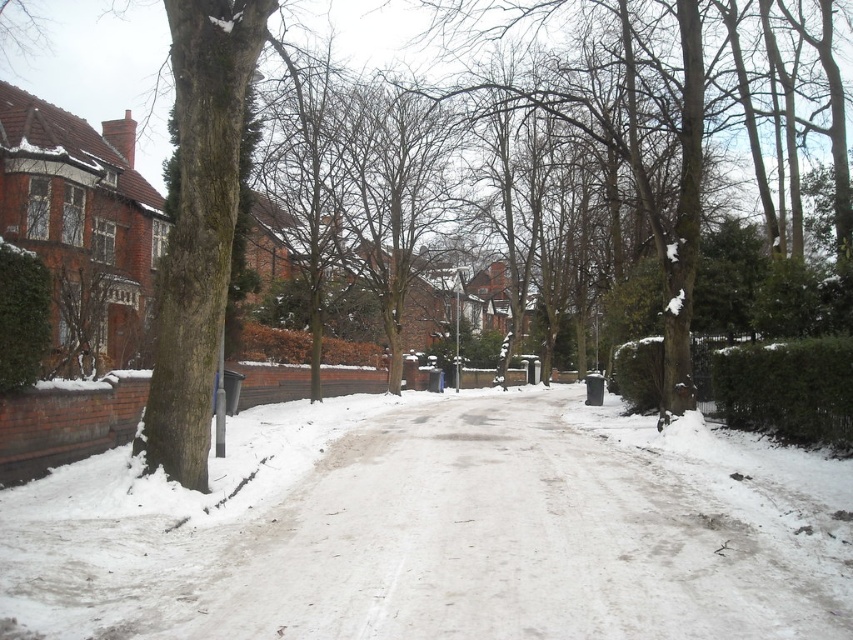
You are standing at the point labeled point (196,252) and want to walk to the point labeled point (700,541). Based on the scene description, which direction should you face to move towards your destination?

You should face towards the direction of point (700,541) since it is in front of point (196,252).

You are a delivery person trying to walk from the red brick building to the green mossy bark tree at left. The white powdery snow at center is slippery. Can you walk directly to the tree without stepping on the snow?

The white powdery snow at center occupies less space than the green mossy bark tree at left, so there might be enough space to walk around the snow. However, since the snow is in the center, it might block the direct path. You would need to check the exact layout to be sure.

You are a delivery person trying to navigate a narrow path between two snowdrifts. The path is located at the center of the street. According to the coordinates provided, is the white powdery snow at center in a position that would block your path?

The white powdery snow at center is located at coordinates point (440, 531), which is at the center of the street. This means it is directly in the path and would block the delivery person from passing through.